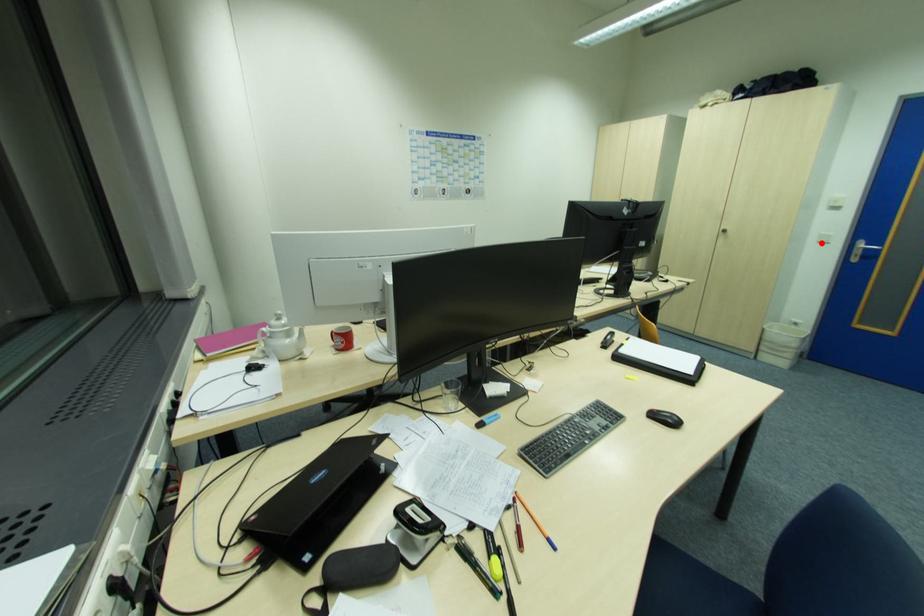
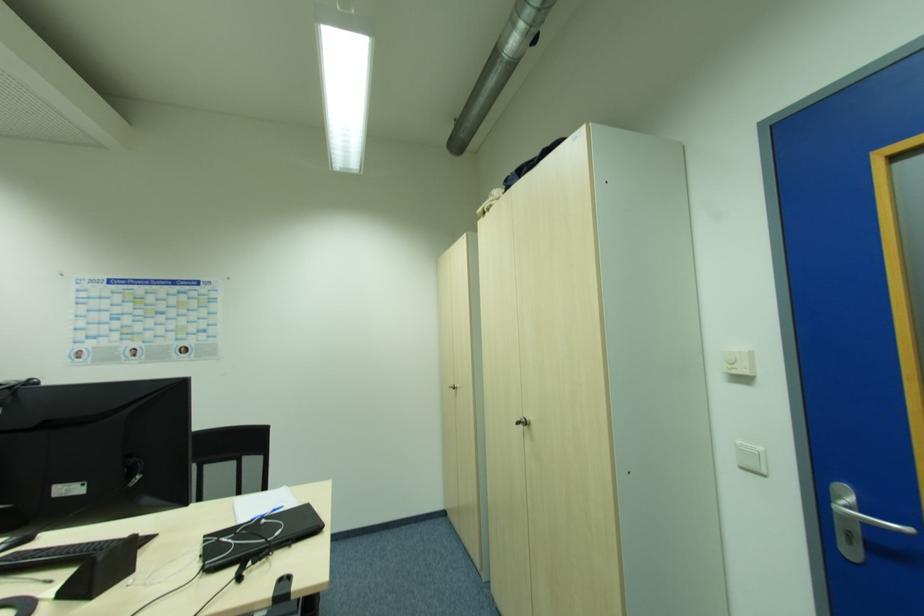
Locate, in the second image, the point that corresponds to the highlighted location in the first image.

(746, 469)